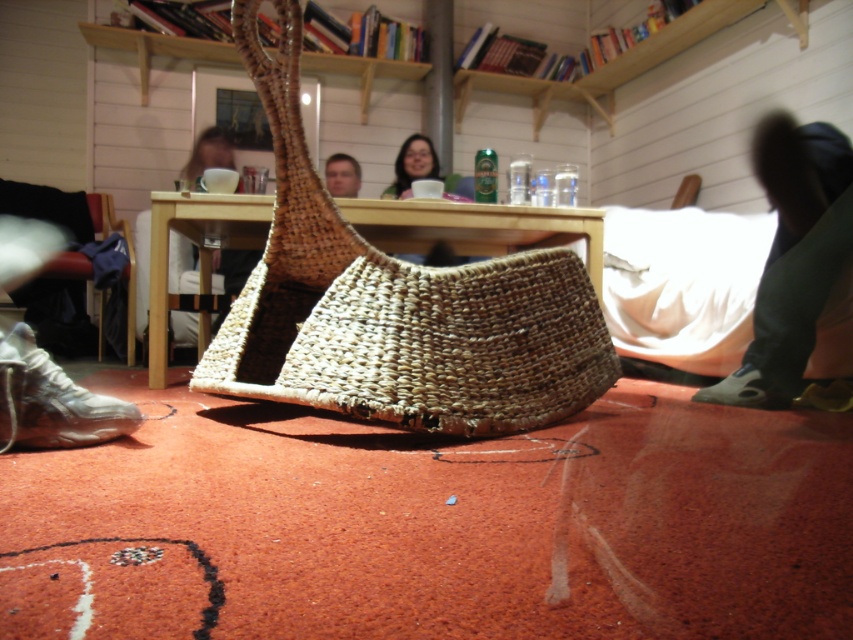
Question: Is natural fiber basket at center thinner than matte black face at upper center?

Choices:
 (A) yes
 (B) no

Answer: (B)

Question: Can you confirm if dark green fabric pants at lower right is positioned below white leather shoe at lower left?

Choices:
 (A) no
 (B) yes

Answer: (A)

Question: Which point is closer to the camera taking this photo?

Choices:
 (A) (398, 196)
 (B) (196, 332)
 (C) (735, 372)
 (D) (349, 166)

Answer: (C)

Question: Based on their relative distances, which object is farther from the black leather shoe at lower right?

Choices:
 (A) matte black face at upper center
 (B) matte white cup at upper center
 (C) matte white cup at center

Answer: (A)

Question: Is white leather shoe at lower left positioned in front of black leather shoe at lower right?

Choices:
 (A) no
 (B) yes

Answer: (B)

Question: Which of the following is the closest to the observer?

Choices:
 (A) matte black face at upper center
 (B) dark green fabric pants at lower right

Answer: (B)